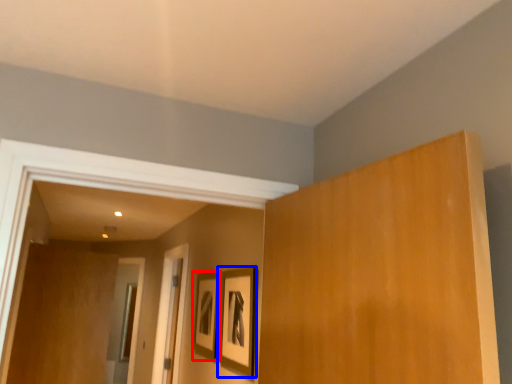
Question: Which object appears closest to the camera in this image, picture frame (highlighted by a red box) or picture frame (highlighted by a blue box)?

Choices:
 (A) picture frame
 (B) picture frame

Answer: (B)